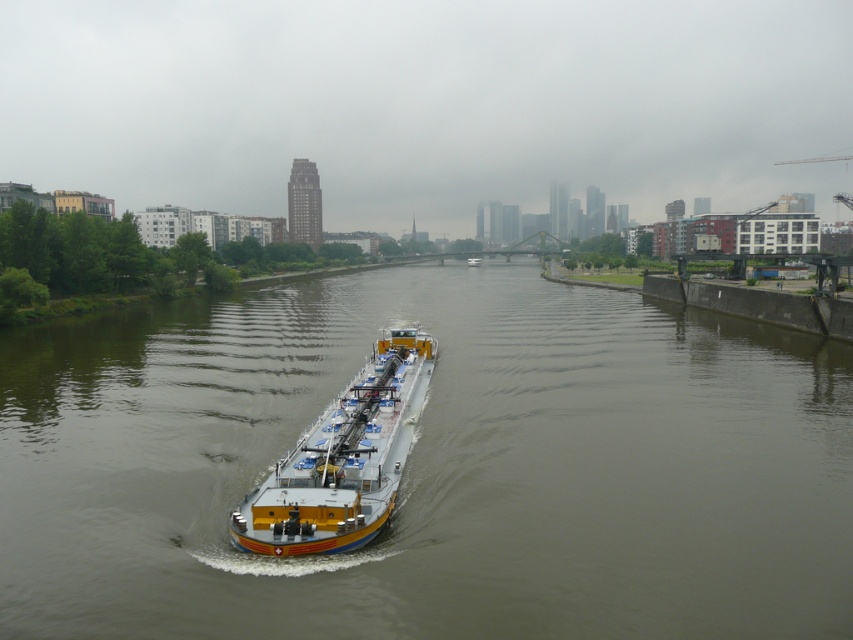
Based on the photo, you are a boat operator who needs to navigate a small motorboat through the river. Given that the smooth concrete river at center is larger than the yellow metallic barge at center, can you safely maneuver your boat around the barge?

The smooth concrete river at center has a larger size compared to the yellow metallic barge at center, so yes, you can safely maneuver your boat around the barge by navigating through the wider river area.

You are standing at the point marked by coordinate point (432,467) in the river. What type of surface are you currently on?

You are standing on the smooth concrete river at center, as the point (432,467) corresponds to this surface.

You are a photographer planning to capture the river scene. You have two identical cameras. You want to place one camera on the yellow metallic barge at center and the other on the yellow matte barge at center. Since the barges have different widths, which barge will allow the camera to be placed farther from the edge to avoid accidental drops?

The yellow matte barge at center is wider than the yellow metallic barge at center, so placing the camera on the yellow matte barge at center allows it to be placed farther from the edge, reducing the risk of accidental drops.